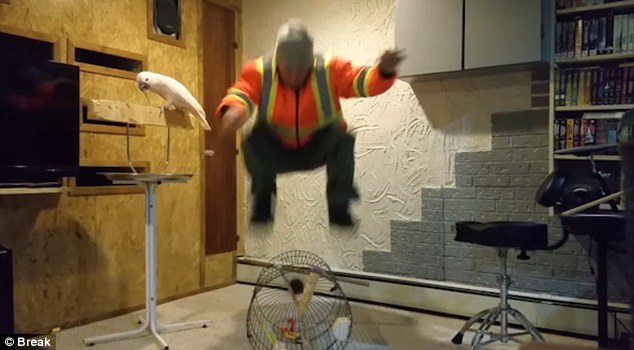
Locate an element on the screen. left white cupboard is located at coordinates (411, 39).